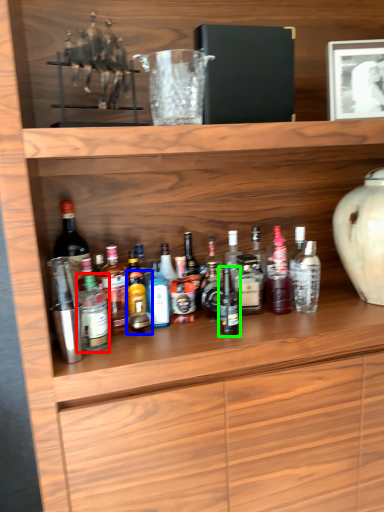
Question: Based on their relative distances, which object is nearer to bottle (highlighted by a red box)? Choose from bottle (highlighted by a blue box) and bottle (highlighted by a green box).

Choices:
 (A) bottle
 (B) bottle

Answer: (A)